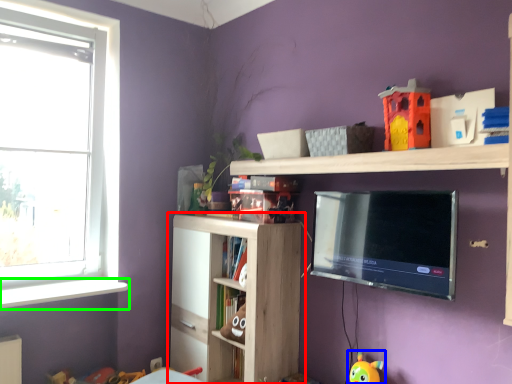
Question: Which object is positioned closest to shelf (highlighted by a red box)? Select from toy (highlighted by a blue box) and window sill (highlighted by a green box).

Choices:
 (A) toy
 (B) window sill

Answer: (B)